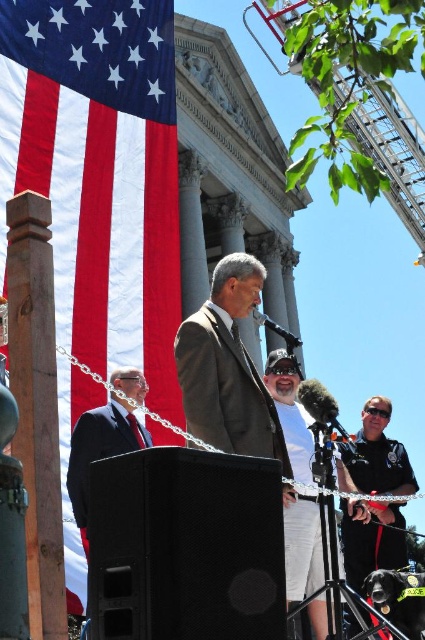
From the picture: You are a photographer positioned at the front of the event. You need to capture a clear photo of both the black matte speaker at lower center and the dark gray suit at center. Which object should you focus on first to ensure both are in focus?

The black matte speaker at lower center is closer to the viewer than dark gray suit at center. To ensure both are in focus, you should focus on the black matte speaker at lower center first, as it is closer, and adjust the depth of field to include the dark gray suit at center in the background.

You are attending a formal outdoor event and need to locate the speaker. You see the black matte speaker at lower center and the dark gray suit at center. Which object is closer to the left side of the scene?

The black matte speaker at lower center is positioned on the left side of dark gray suit at center, so it is closer to the left side of the scene.